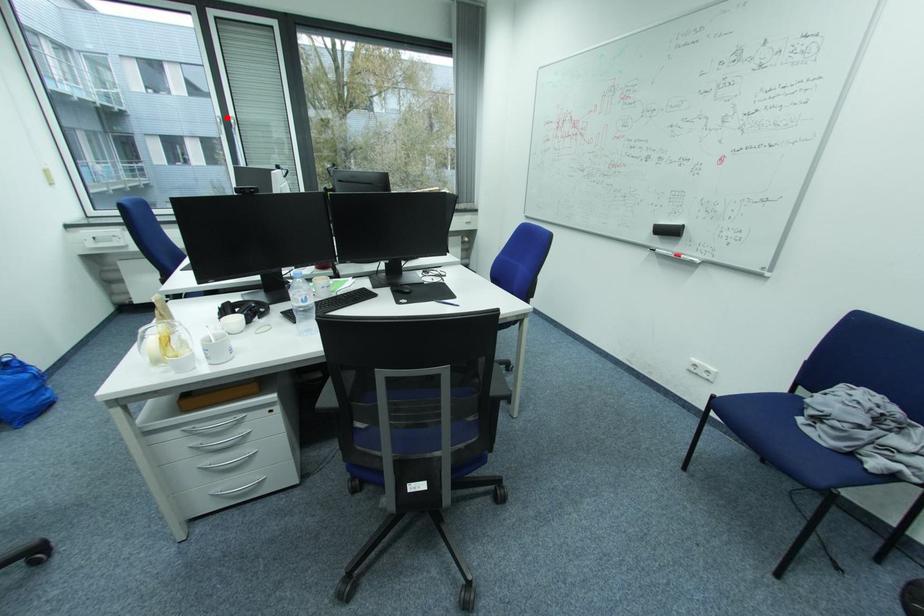
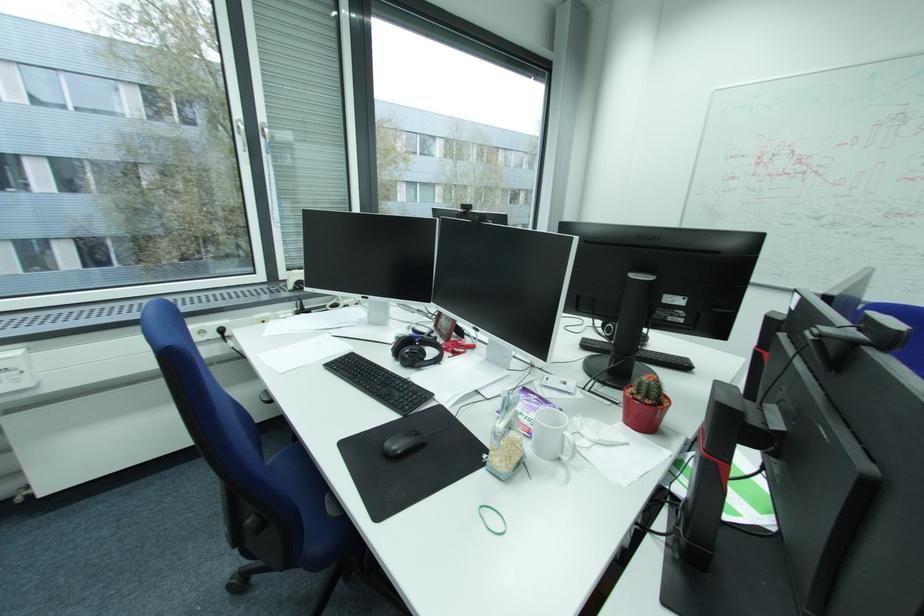
Where in the second image is the point corresponding to the highlighted location from the first image?

(247, 121)